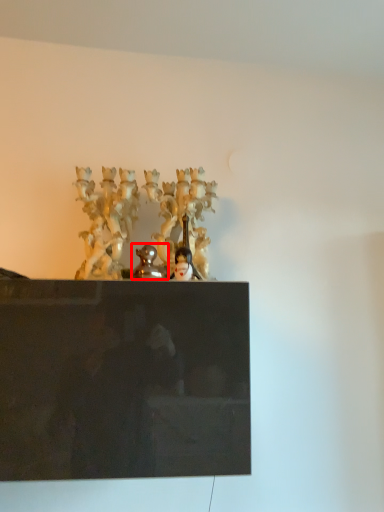
Question: From the image's perspective, considering the relative positions of sculpture (annotated by the red box) and person in the image provided, where is sculpture (annotated by the red box) located with respect to the staircase?

Choices:
 (A) above
 (B) below

Answer: (A)